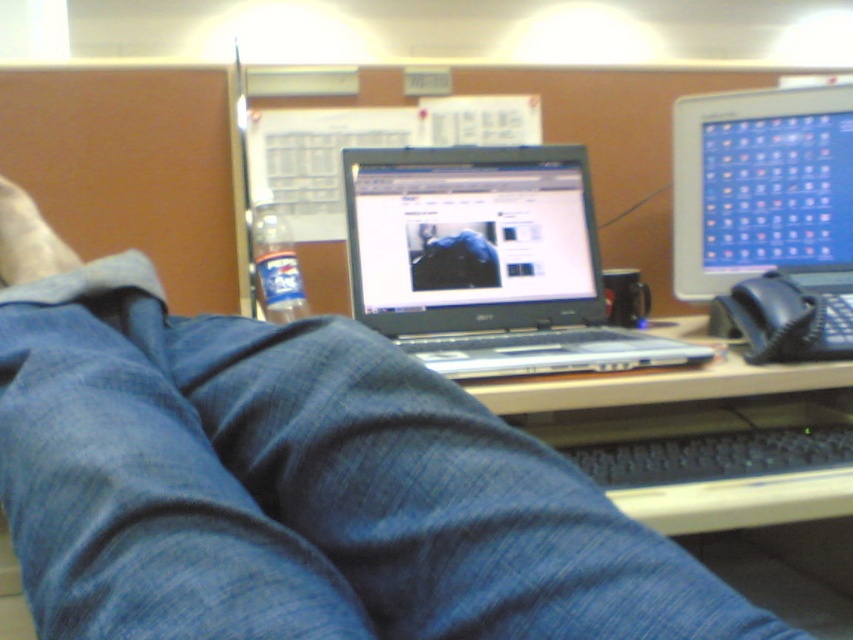
Question: Which of the following is the farthest from the observer?

Choices:
 (A) white fabric foot at lower left
 (B) sleek silver laptop at center

Answer: (B)

Question: Is sleek silver laptop at center to the right of white fabric foot at lower left from the viewer's perspective?

Choices:
 (A) yes
 (B) no

Answer: (A)

Question: Does denim pants at lower center appear on the left side of matte plastic monitor at upper right?

Choices:
 (A) no
 (B) yes

Answer: (B)

Question: Which object appears farthest from the camera in this image?

Choices:
 (A) sleek silver laptop at center
 (B) matte plastic monitor at upper right

Answer: (B)

Question: Does denim pants at lower center appear on the left side of white fabric foot at lower left?

Choices:
 (A) yes
 (B) no

Answer: (B)

Question: Estimate the real-world distances between objects in this image. Which object is farther from the sleek silver laptop at center?

Choices:
 (A) denim pants at lower center
 (B) white fabric foot at lower left

Answer: (B)